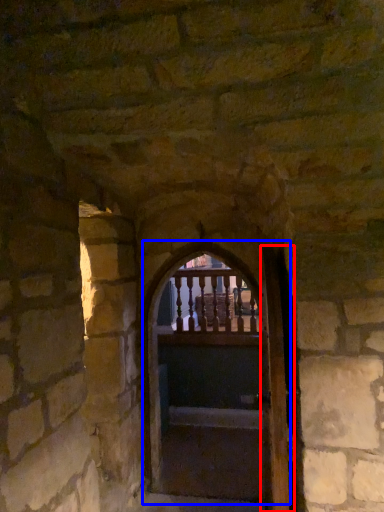
Question: Which object is closer to the camera taking this photo, door (highlighted by a red box) or door (highlighted by a blue box)?

Choices:
 (A) door
 (B) door

Answer: (A)